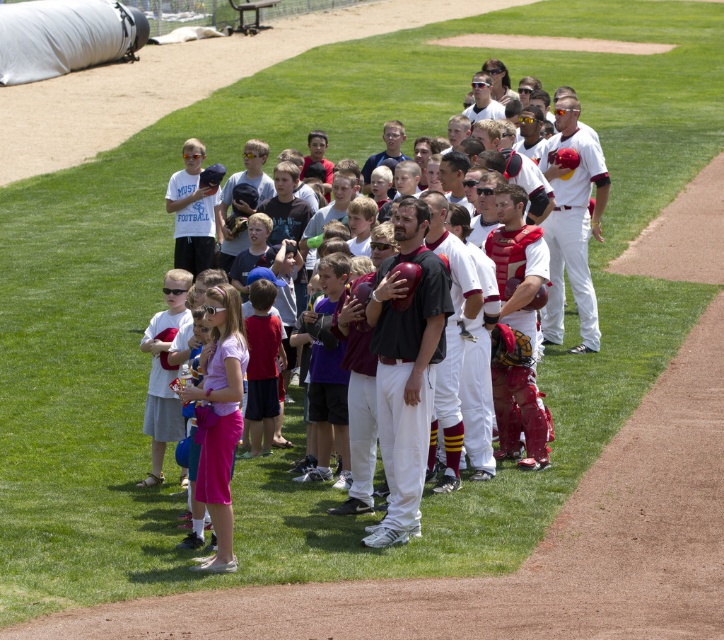
Does pink fabric dress at center lie behind white uniform baseball team at center?

No, it is not.

Image resolution: width=724 pixels, height=640 pixels. Find the location of `pink fabric dress at center`. pink fabric dress at center is located at coordinates (219, 417).

Where is `pink fabric dress at center`? pink fabric dress at center is located at coordinates (219, 417).

I want to click on pink fabric dress at center, so click(x=219, y=417).

Is pink fabric dress at center above maroon leather catcher's gear at center?

Actually, pink fabric dress at center is below maroon leather catcher's gear at center.

Consider the image. Is pink fabric dress at center wider than maroon leather catcher's gear at center?

No.

Find the location of a particular element. Image resolution: width=724 pixels, height=640 pixels. pink fabric dress at center is located at coordinates (219, 417).

At what (x,y) coordinates should I click in order to perform the action: click on pink fabric dress at center. Please return your answer as a coordinate pair (x, y). This screenshot has width=724, height=640. Looking at the image, I should click on (219, 417).

Does maroon leather catcher's gear at center have a smaller size compared to black matte baseball uniform at center?

Correct, maroon leather catcher's gear at center occupies less space than black matte baseball uniform at center.

Which of these two, maroon leather catcher's gear at center or black matte baseball uniform at center, stands taller?

Standing taller between the two is black matte baseball uniform at center.

Does point (494, 257) come behind point (437, 291)?

That is True.

What are the coordinates of `maroon leather catcher's gear at center` in the screenshot? It's located at (518, 342).